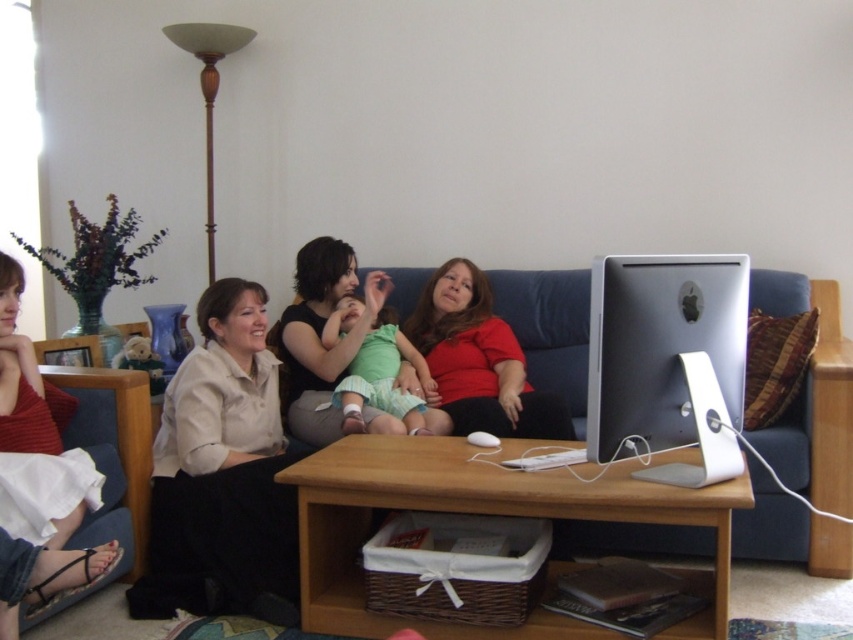
Where is the matte red shirt at center located in the image?

The matte red shirt at center is located at point coordinates of (479, 360).

Based on the photo, you are a photographer setting up a shoot in this living room. You notice two shirts hanging on the back of the blue sofa. The white matte shirt at center and the matte black shirt at center. Which shirt is positioned to the left when viewed from the photographer standing in front of the sofa?

The white matte shirt at center is to the left of the matte black shirt at center when viewed from the photographer standing in front of the sofa.